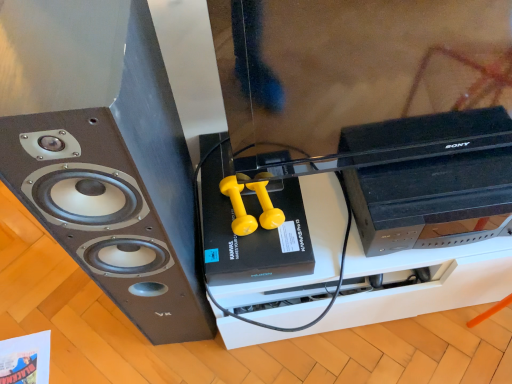
Where is `vacant region above black matte speaker at left (from a real-world perspective)`? The width and height of the screenshot is (512, 384). vacant region above black matte speaker at left (from a real-world perspective) is located at coordinates (55, 36).